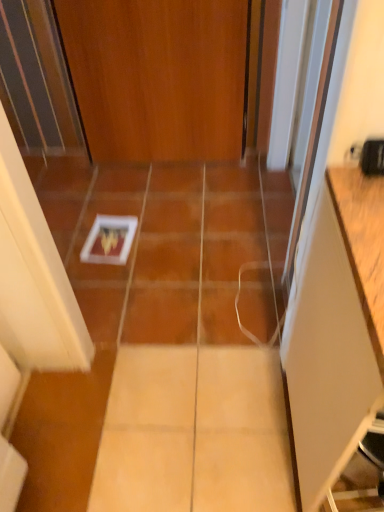
What is the approximate height of white matte cabinet at right?

The height of white matte cabinet at right is 34.89 inches.

Describe the element at coordinates (338, 331) in the screenshot. I see `white matte cabinet at right` at that location.

You are a GUI agent. You are given a task and a screenshot of the screen. Output one action in this format:
    pyautogui.click(x=<x>, y=<y>)
    Task: Click on the white matte cabinet at right
    This screenshot has width=384, height=512.
    Given the screenshot: What is the action you would take?
    pyautogui.click(x=338, y=331)

Describe the element at coordinates (157, 76) in the screenshot. This screenshot has width=384, height=512. I see `wooden door at center` at that location.

Measure the distance between wooden door at center and camera.

wooden door at center and camera are 1.83 meters apart.

Find the location of `wooden door at center`. wooden door at center is located at coordinates (157, 76).

Find the location of a particular element. The image size is (384, 512). white matte cabinet at right is located at coordinates (338, 331).

Which is more to the left, wooden door at center or white matte cabinet at right?

wooden door at center.

Which is behind, wooden door at center or white matte cabinet at right?

Answer: wooden door at center is more distant.

Does point (202, 126) lie in front of point (315, 286)?

No, (202, 126) is behind (315, 286).

From the image's perspective, which is above, wooden door at center or white matte cabinet at right?

wooden door at center, from the image's perspective.

From a real-world perspective, does wooden door at center sit lower than white matte cabinet at right?

No.

Does wooden door at center have a lesser width compared to white matte cabinet at right?

Correct, the width of wooden door at center is less than that of white matte cabinet at right.

Is wooden door at center taller or shorter than white matte cabinet at right?

Considering their sizes, wooden door at center has less height than white matte cabinet at right.

In terms of size, does wooden door at center appear bigger or smaller than white matte cabinet at right?

In the image, wooden door at center appears to be smaller than white matte cabinet at right.

Would you say white matte cabinet at right is part of wooden door at center's contents?

Actually, white matte cabinet at right is outside wooden door at center.

Is wooden door at center touching white matte cabinet at right?

No, wooden door at center is not making contact with white matte cabinet at right.

Could you tell me if wooden door at center is facing white matte cabinet at right?

Yes, wooden door at center is facing white matte cabinet at right.

How many degrees apart are the facing directions of wooden door at center and white matte cabinet at right?

1.34 degrees.

There is a white matte cabinet at right. At what (x,y) coordinates should I click in order to perform the action: click on door above it (from a real-world perspective). Please return your answer as a coordinate pair (x, y). Image resolution: width=384 pixels, height=512 pixels. Looking at the image, I should click on (157, 76).

Is white matte cabinet at right to the left of wooden door at center from the viewer's perspective?

No.

Considering their positions, is white matte cabinet at right located in front of or behind wooden door at center?

In the image, white matte cabinet at right appears in front of wooden door at center.

Between point (347, 200) and point (136, 0), which one is positioned behind?

The point (136, 0) is behind.

From the image's perspective, between white matte cabinet at right and wooden door at center, who is located below?

white matte cabinet at right.

From a real-world perspective, is white matte cabinet at right above or below wooden door at center?

white matte cabinet at right is below wooden door at center.

Based on the photo, which of these two, white matte cabinet at right or wooden door at center, is wider?

Wider between the two is white matte cabinet at right.

From their relative heights in the image, would you say white matte cabinet at right is taller or shorter than wooden door at center?

white matte cabinet at right is taller than wooden door at center.

Between white matte cabinet at right and wooden door at center, which one has smaller size?

With smaller size is wooden door at center.

Can wooden door at center be found inside white matte cabinet at right?

No, wooden door at center is located outside of white matte cabinet at right.

Does white matte cabinet at right touch wooden door at center?

There is a gap between white matte cabinet at right and wooden door at center.

Is white matte cabinet at right facing towards wooden door at center?

No, white matte cabinet at right does not turn towards wooden door at center.

Can you tell me how much white matte cabinet at right and wooden door at center differ in facing direction?

1.34 degrees.

Locate an element on the screen. The image size is (384, 512). door above the white matte cabinet at right (from a real-world perspective) is located at coordinates (157, 76).

The width and height of the screenshot is (384, 512). Identify the location of door behind the white matte cabinet at right. (157, 76).

In order to click on cabinetry on the right of wooden door at center in this screenshot , I will do [338, 331].